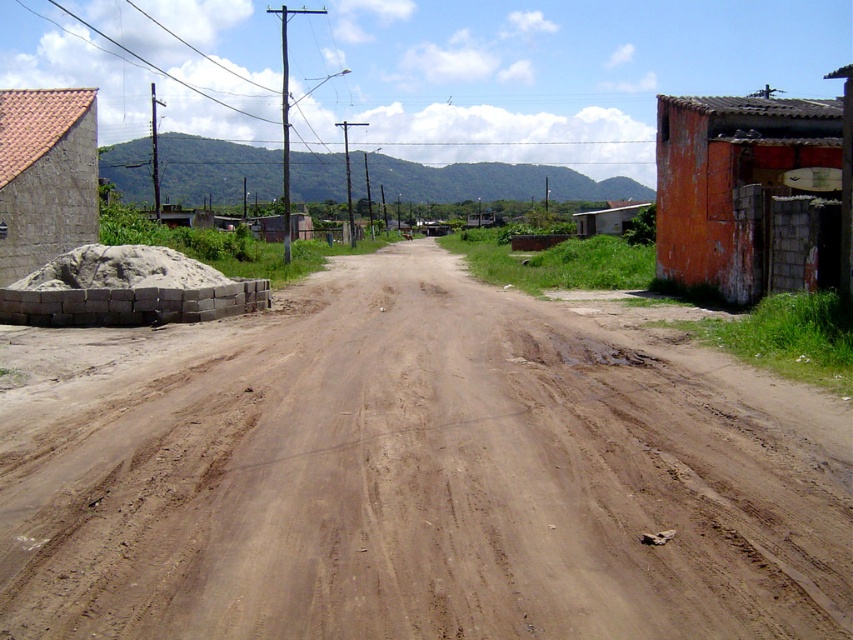
The height and width of the screenshot is (640, 853). Find the location of `brown dirt field at center`. brown dirt field at center is located at coordinates (422, 477).

Image resolution: width=853 pixels, height=640 pixels. What do you see at coordinates (422, 477) in the screenshot? I see `brown dirt field at center` at bounding box center [422, 477].

Find the location of `brown dirt field at center`. brown dirt field at center is located at coordinates (422, 477).

Between point (790, 449) and point (49, 93), which one is positioned behind?

Point (49, 93)

Who is lower down, brown dirt field at center or red tile roof at left?

brown dirt field at center

Is point (791, 452) more distant than point (10, 189)?

No, it is in front of (10, 189).

Where is `brown dirt field at center`? Image resolution: width=853 pixels, height=640 pixels. brown dirt field at center is located at coordinates (422, 477).

Which is below, orange painted concrete hut at right or red tile roof at left?

orange painted concrete hut at right is lower down.

Between orange painted concrete hut at right and red tile roof at left, which one has less height?

orange painted concrete hut at right

At what (x,y) coordinates should I click in order to perform the action: click on orange painted concrete hut at right. Please return your answer as a coordinate pair (x, y). This screenshot has width=853, height=640. Looking at the image, I should click on (747, 193).